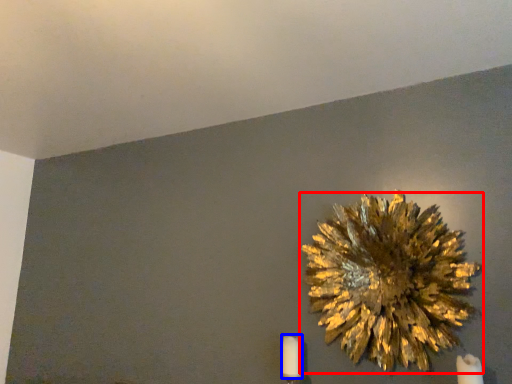
Question: Which point is further to the camera, flower (highlighted by a red box) or candle (highlighted by a blue box)?

Choices:
 (A) flower
 (B) candle

Answer: (B)